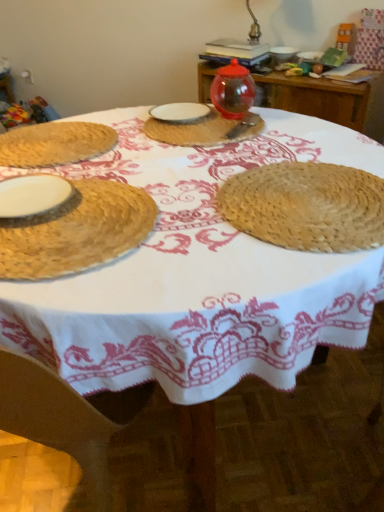
The height and width of the screenshot is (512, 384). I want to click on vacant space situated on the left part of natural straw placemat at center, so click(174, 207).